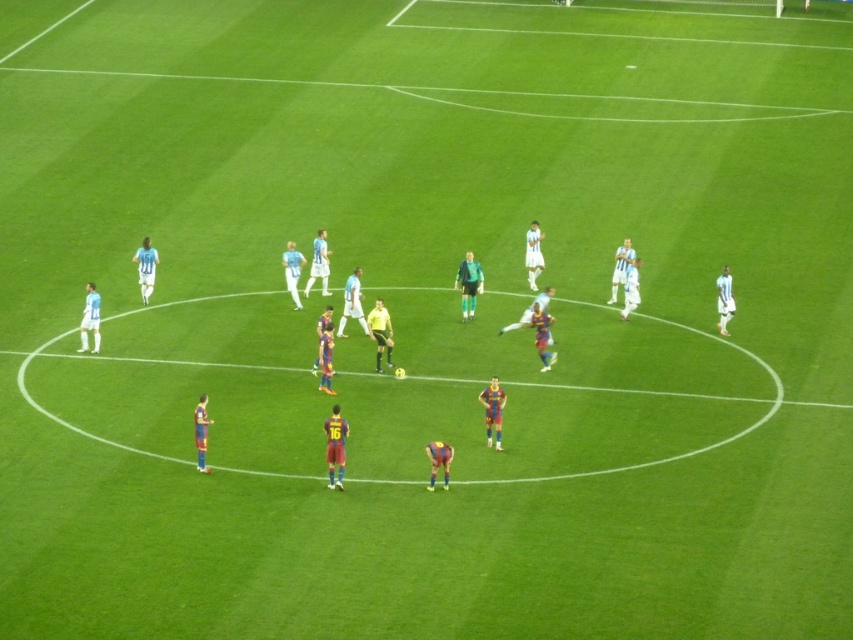
Question: Which of these objects is positioned closest to the white matte jersey at center?

Choices:
 (A) blue jersey at left
 (B) white jersey at center
 (C) blue jersey at center

Answer: (C)

Question: Which object is positioned closest to the blue jersey at left?

Choices:
 (A) blue jersey at center
 (B) white jersey at center
 (C) white matte jersey at center
 (D) green jersey at center

Answer: (B)

Question: Does blue jersey at center appear over blue jersey at left?

Choices:
 (A) no
 (B) yes

Answer: (A)

Question: Which point appears closest to the camera in this image?

Choices:
 (A) (144, 244)
 (B) (532, 262)

Answer: (A)

Question: Does maroon jersey at center appear under green jersey at center?

Choices:
 (A) yes
 (B) no

Answer: (A)

Question: Is maroon jersey at center to the right of blue jersey at center from the viewer's perspective?

Choices:
 (A) no
 (B) yes

Answer: (B)